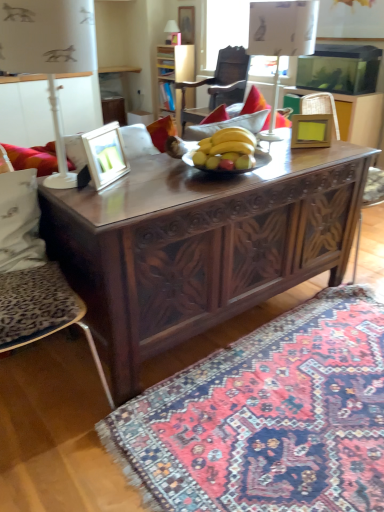
Where is `vacant region to the right of white plastic lamp at left, placed as the 3th lamp when sorted from back to front`? The image size is (384, 512). vacant region to the right of white plastic lamp at left, placed as the 3th lamp when sorted from back to front is located at coordinates (148, 179).